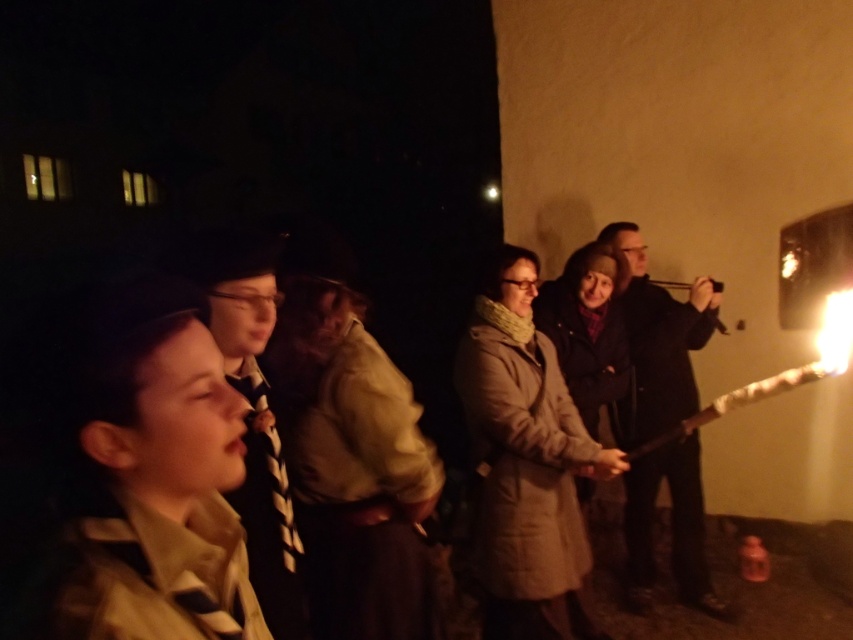
Question: From the image, what is the correct spatial relationship of tan fabric uniform at left in relation to dark brown leather jacket at center?

Choices:
 (A) above
 (B) below

Answer: (A)

Question: Is tan fabric uniform at left closer to the viewer compared to striped tie at center?

Choices:
 (A) yes
 (B) no

Answer: (A)

Question: Which object is farther from the camera taking this photo?

Choices:
 (A) tan fabric uniform at left
 (B) light brown leather jacket at center

Answer: (B)

Question: Among these objects, which one is farthest from the camera?

Choices:
 (A) striped tie at center
 (B) light brown leather jacket at center

Answer: (B)

Question: Is dark brown leather jacket at center smaller than striped tie at center?

Choices:
 (A) yes
 (B) no

Answer: (B)

Question: Which point is farther to the camera?

Choices:
 (A) light brown leather jacket at center
 (B) tan fabric uniform at left

Answer: (A)